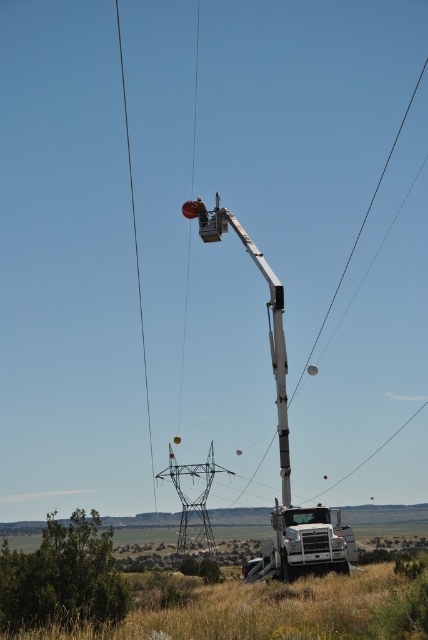
You are a delivery driver who needs to park your truck so that it doesn not block the view of the metallic gray tower at center from the matte white trailer truck at lower right. Where should you position your truck?

The matte white trailer truck at lower right is already positioned above the metallic gray tower at center, so parking it there would block the view. Move the truck to a lower position to ensure the metallic gray tower at center remains visible from the matte white trailer truck at lower right.

You are a delivery driver who needs to park your truck at the matte white trailer truck at lower right. The parking space is 20 feet long. Is your truck longer than the parking space?

The distance between the matte white trailer truck at lower right and the utility tower is 73.90 feet. This information does not provide the length of the truck, so it is impossible to determine if the truck is longer than the parking space.

You are a delivery driver who needs to park your truck at least 100 feet away from the utility tower to avoid obstructing emergency access. Given that the matte white trailer truck at lower right is currently positioned 73.90 feet away from the utility tower, is your current parking position compliant with the safety regulations?

The matte white trailer truck at lower right is currently 73.90 feet away from the utility tower, which is less than the required 100 feet. Therefore, the parking position is not compliant with the safety regulations.